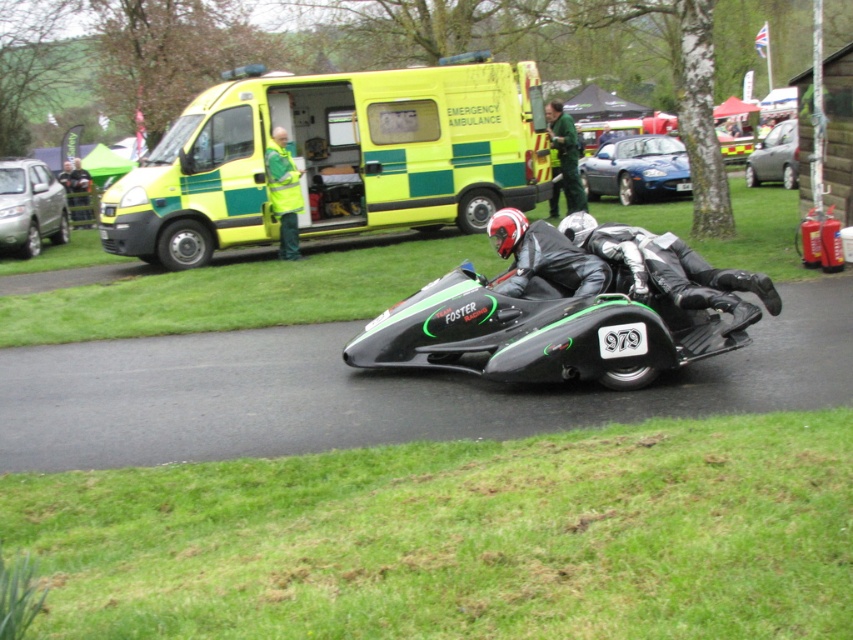
Who is more distant from viewer, (491, 228) or (553, 198)?

Point (553, 198)

Does shiny black helmet at center appear over green reflective jacket at center?

Incorrect, shiny black helmet at center is not positioned above green reflective jacket at center.

Between point (543, 225) and point (579, 188), which one is positioned in front?

Point (543, 225) is more forward.

Where is `shiny black helmet at center`? The image size is (853, 640). shiny black helmet at center is located at coordinates (543, 256).

Who is taller, black leather suit at center or silver metallic car at left?

silver metallic car at left is taller.

Is black leather suit at center positioned at the back of silver metallic car at left?

A: No, it is not.

Between point (630, 230) and point (33, 192), which one is positioned in front?

Point (630, 230)

Identify the location of black leather suit at center. (672, 269).

Does black matte sidecar at center appear on the left side of metallic silver car at right?

Yes, black matte sidecar at center is to the left of metallic silver car at right.

Is the position of black matte sidecar at center less distant than that of metallic silver car at right?

Yes.

You are a GUI agent. You are given a task and a screenshot of the screen. Output one action in this format:
    pyautogui.click(x=<x>, y=<y>)
    Task: Click on the black matte sidecar at center
    This screenshot has height=640, width=853.
    Given the screenshot: What is the action you would take?
    pyautogui.click(x=537, y=333)